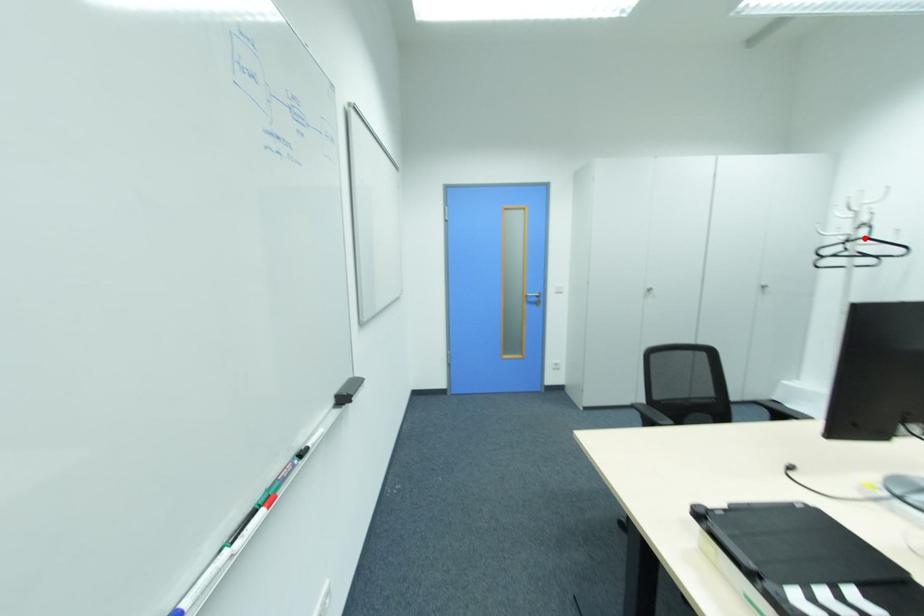
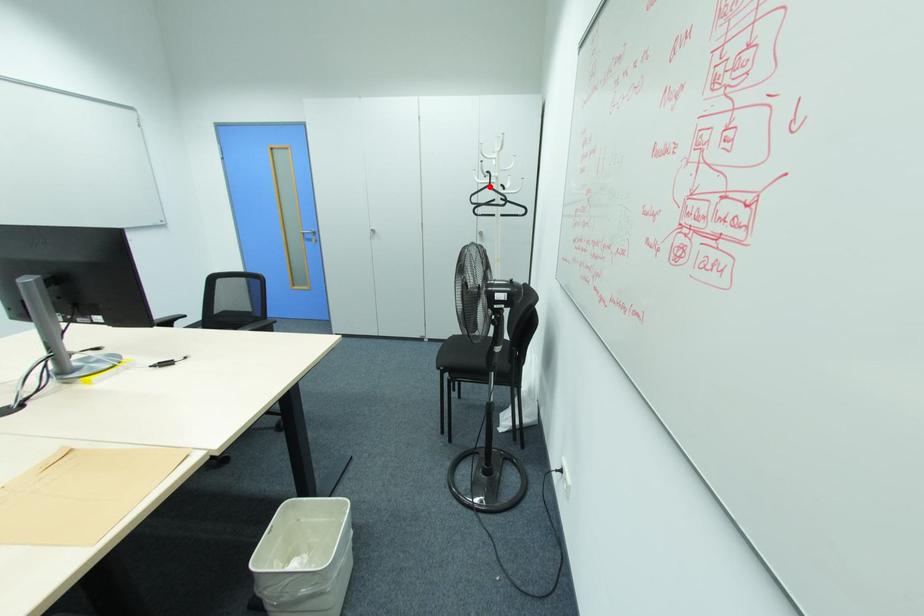
I am providing you with two images of the same scene from different viewpoints. A red point is marked on the first image and another point is marked on the second image. Is the red point in image1 aligned with the point shown in image2?

Yes